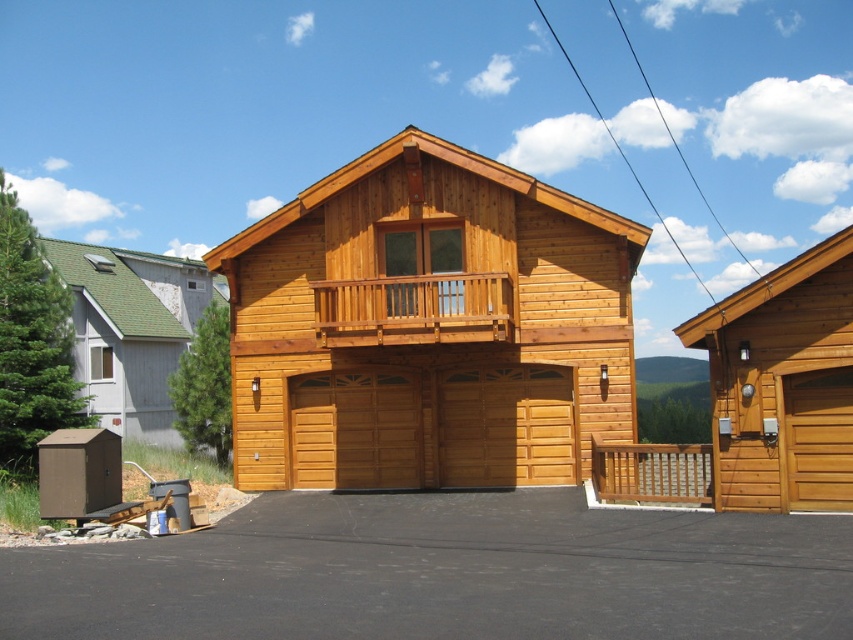
Question: Which is farther from the wooden garage door at center?

Choices:
 (A) natural wood cabin at center
 (B) white wood cabin at left
 (C) wooden cabin at right

Answer: (B)

Question: Can you confirm if black asphalt driveway at lower center is positioned below wooden garage door at center?

Choices:
 (A) yes
 (B) no

Answer: (A)

Question: Does wooden cabin at right lie in front of natural wood railing at center?

Choices:
 (A) no
 (B) yes

Answer: (B)

Question: Considering the relative positions of natural wood cabin at center and natural wood railing at center in the image provided, where is natural wood cabin at center located with respect to natural wood railing at center?

Choices:
 (A) left
 (B) right

Answer: (A)

Question: Which of the following is the farthest from the observer?

Choices:
 (A) wooden at right
 (B) wooden garage door at center
 (C) black asphalt driveway at lower center
 (D) natural wood railing at center

Answer: (B)

Question: Which point is closer to the camera?

Choices:
 (A) wooden at right
 (B) black asphalt driveway at lower center
 (C) wooden cabin at right

Answer: (B)